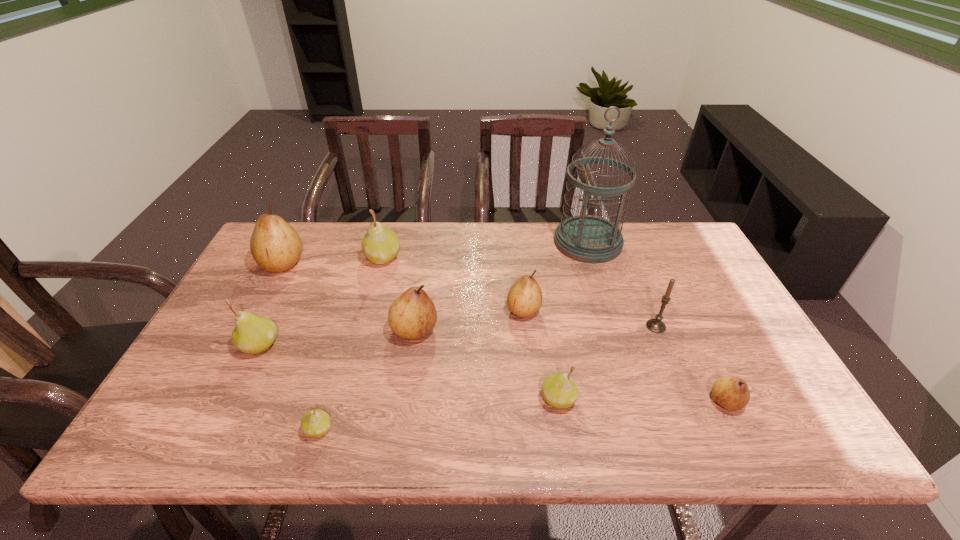
Identify the location of the tallest object. The image size is (960, 540). (586, 238).

This screenshot has width=960, height=540. Identify the location of the farthest green pear. (380, 244).

Find the location of a particular element. The image size is (960, 540). the farthest brown pear is located at coordinates (276, 247).

At what (x,y) coordinates should I click in order to perform the action: click on the leftmost brown pear. Please return your answer as a coordinate pair (x, y). Looking at the image, I should click on (276, 247).

Locate an element on the screen. The height and width of the screenshot is (540, 960). gray candle is located at coordinates (656, 325).

In order to click on the third smallest brown pear in this screenshot , I will do `click(412, 315)`.

Where is `the fifth object from left to right`? The width and height of the screenshot is (960, 540). the fifth object from left to right is located at coordinates (412, 315).

The image size is (960, 540). Find the location of `the third nearest green pear`. the third nearest green pear is located at coordinates (252, 334).

This screenshot has height=540, width=960. Identify the location of the second biggest green pear. (252, 334).

The image size is (960, 540). In order to click on the second smallest brown pear in this screenshot , I will do `click(524, 299)`.